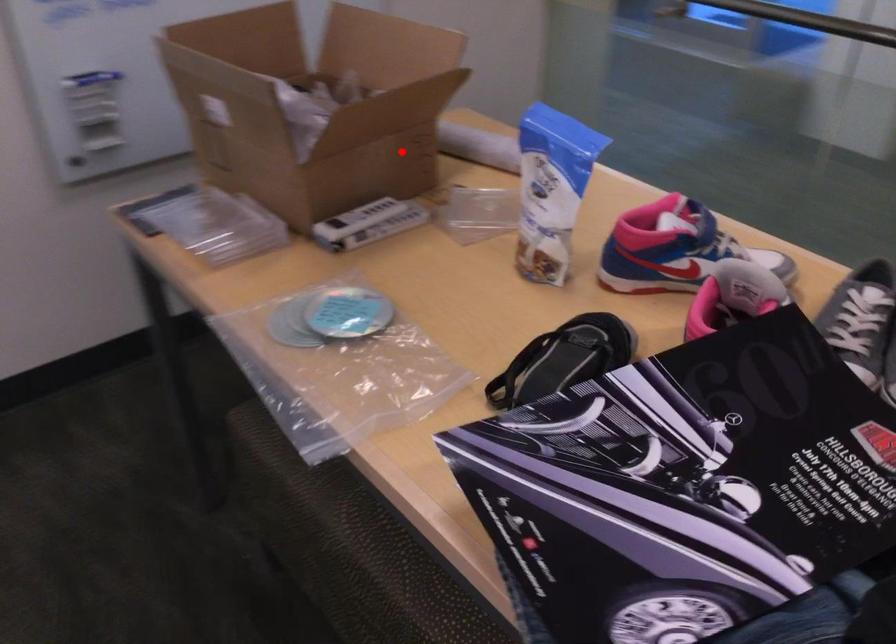
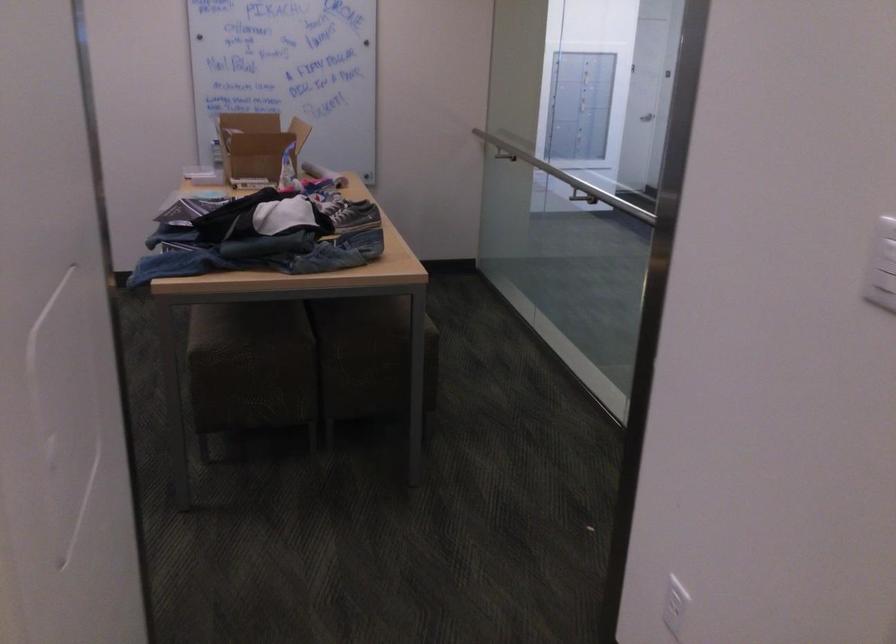
Question: A red point is marked in image1. In image2, is the corresponding 3D point closer to the camera or farther? Reply with the corresponding letter.

Choices:
 (A) The corresponding 3D point is closer.
 (B) The corresponding 3D point is farther.

Answer: (B)